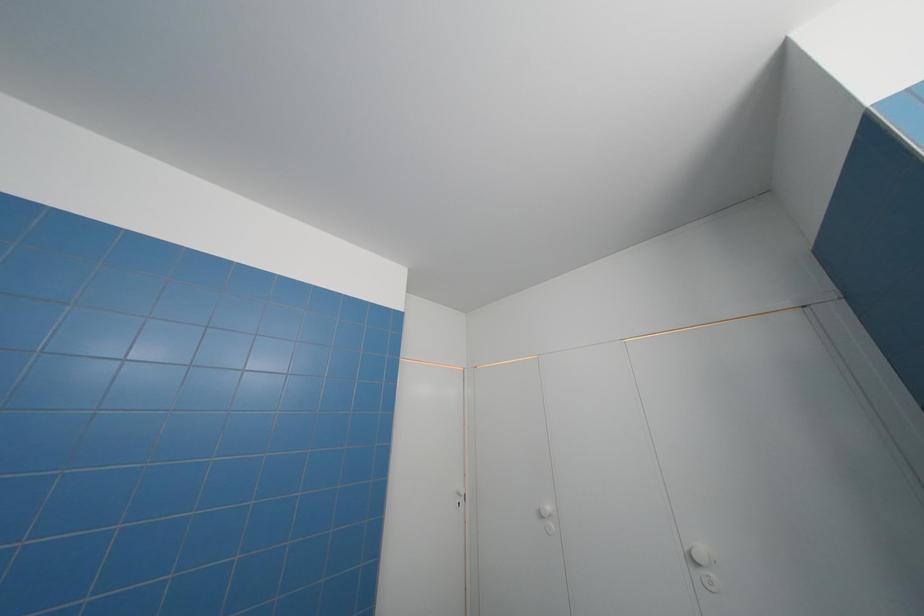
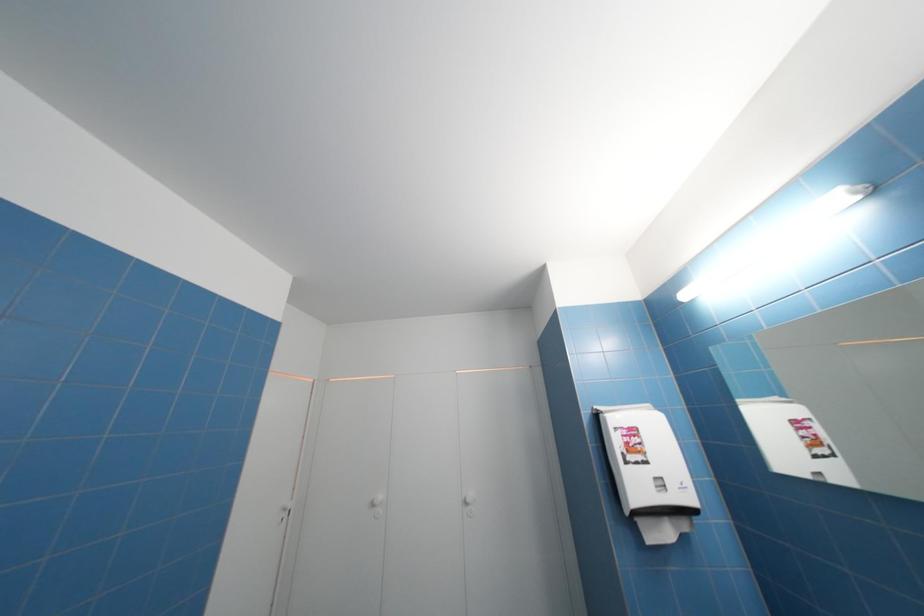
Question: The first image is from the beginning of the video and the second image is from the end. How did the camera likely rotate when shooting the video?

Choices:
 (A) Left
 (B) Right
 (C) Up
 (D) Down

Answer: (B)